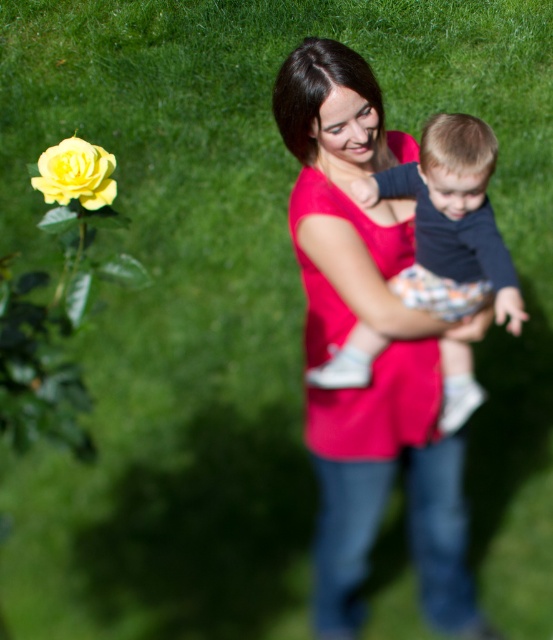
Question: Does matte pink shirt at center have a lesser width compared to yellow matte rose at lower left?

Choices:
 (A) no
 (B) yes

Answer: (A)

Question: Which object is positioned closest to the matte pink shirt at center?

Choices:
 (A) yellow matte rose at lower left
 (B) dark blue cotton shirt at center

Answer: (B)

Question: Which object appears farthest from the camera in this image?

Choices:
 (A) yellow matte rose at lower left
 (B) dark blue cotton shirt at center

Answer: (B)

Question: Does matte pink shirt at center appear over yellow matte rose at lower left?

Choices:
 (A) no
 (B) yes

Answer: (A)

Question: Is dark blue cotton shirt at center bigger than yellow matte rose at lower left?

Choices:
 (A) yes
 (B) no

Answer: (A)

Question: Which of the following is the closest to the observer?

Choices:
 (A) (45, 170)
 (B) (451, 384)
 (C) (364, 564)

Answer: (A)